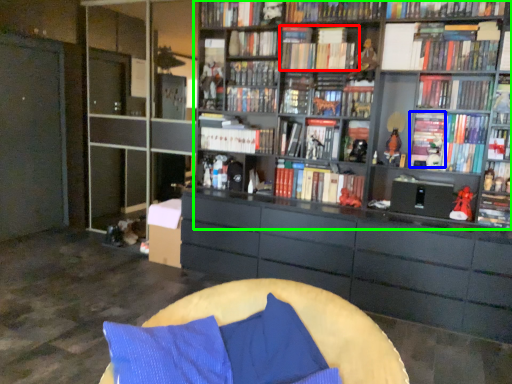
Question: Considering the real-world distances, which object is farthest from book (highlighted by a red box)? book (highlighted by a blue box) or bookcase (highlighted by a green box)?

Choices:
 (A) book
 (B) bookcase

Answer: (A)